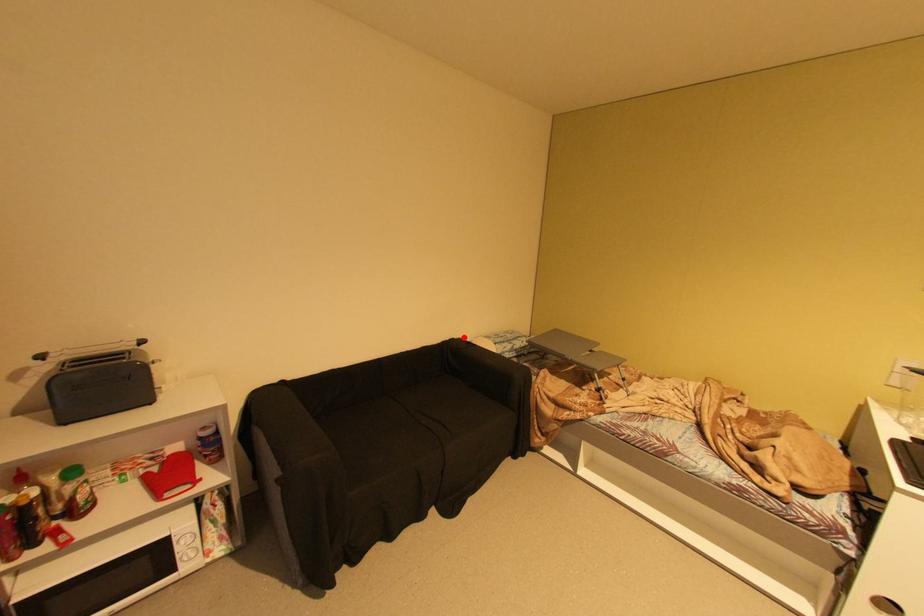
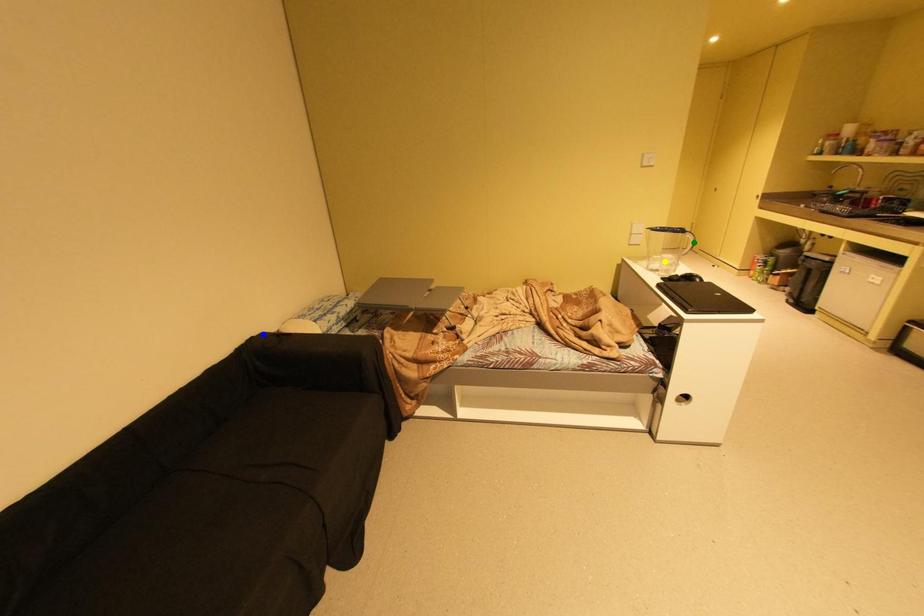
Question: I am providing you with two images of the same scene from different viewpoints. A red point is marked on the first image. You are given multiple points on the second image. In image 2, which mark is for the same physical point as the one in image 1?

Choices:
 (A) blue point
 (B) yellow point
 (C) green point

Answer: (A)